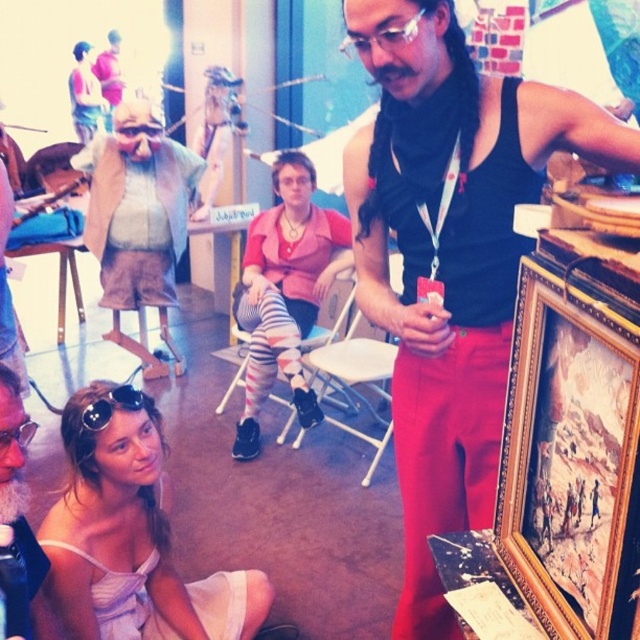
Image resolution: width=640 pixels, height=640 pixels. Describe the element at coordinates (17, 438) in the screenshot. I see `sunglasses at lower left` at that location.

Does sunglasses at lower left have a greater height compared to matte black goggles at upper left?

Incorrect, sunglasses at lower left's height is not larger of matte black goggles at upper left's.

Locate an element on the screen. sunglasses at lower left is located at coordinates (17, 438).

Where is `sunglasses at lower left`? sunglasses at lower left is located at coordinates (17, 438).

Between point (250, 600) and point (96, 410), which one is positioned behind?

Positioned behind is point (250, 600).

Between white fabric dress at lower left and black reflective sunglasses at lower left, which one is positioned higher?

black reflective sunglasses at lower left is above.

The height and width of the screenshot is (640, 640). Identify the location of white fabric dress at lower left. (131, 534).

Can you confirm if goldwooden frame at right is shorter than sunglasses at lower left?

No, goldwooden frame at right is not shorter than sunglasses at lower left.

Is goldwooden frame at right bigger than sunglasses at lower left?

Indeed, goldwooden frame at right has a larger size compared to sunglasses at lower left.

Does point (573, 500) come closer to viewer compared to point (3, 456)?

Yes, it is.

Find the location of a particular element. This screenshot has width=640, height=640. goldwooden frame at right is located at coordinates (570, 458).